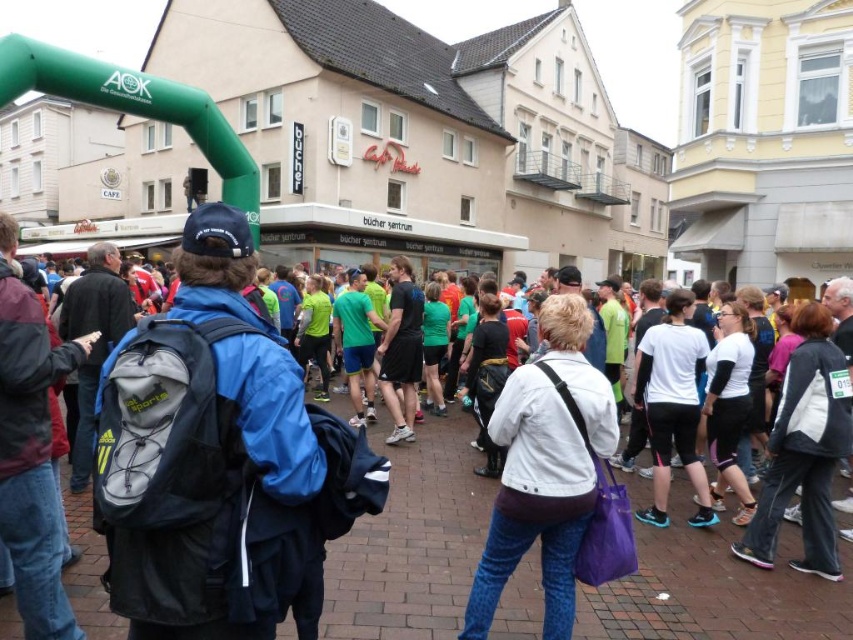
Question: Which object is farther from the camera taking this photo?

Choices:
 (A) matte gray backpack at center
 (B) blue synthetic jacket at center
 (C) white matte jacket at center

Answer: (C)

Question: Does matte gray backpack at center have a lesser width compared to white matte jacket at center?

Choices:
 (A) yes
 (B) no

Answer: (B)

Question: Can you confirm if blue synthetic jacket at center is smaller than matte gray backpack at center?

Choices:
 (A) no
 (B) yes

Answer: (A)

Question: Among these objects, which one is farthest from the camera?

Choices:
 (A) white matte jacket at center
 (B) blue synthetic jacket at center
 (C) matte gray backpack at center

Answer: (A)

Question: From the image, what is the correct spatial relationship of matte gray backpack at center in relation to white matte jacket at center?

Choices:
 (A) below
 (B) above

Answer: (A)

Question: Among these objects, which one is farthest from the camera?

Choices:
 (A) white matte jacket at center
 (B) matte gray backpack at center
 (C) blue synthetic jacket at center

Answer: (A)